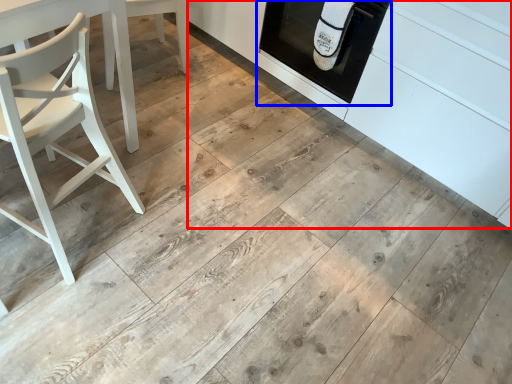
Question: Which object is further to the camera taking this photo, cabinetry (highlighted by a red box) or oven (highlighted by a blue box)?

Choices:
 (A) cabinetry
 (B) oven

Answer: (B)